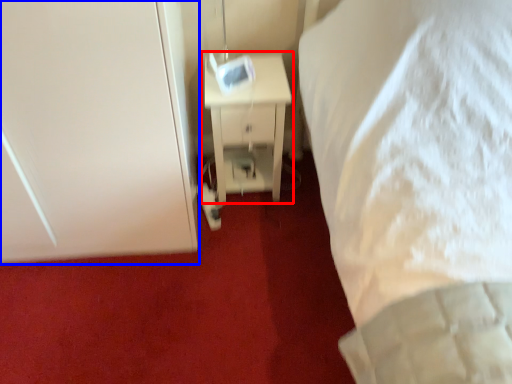
Question: Which object appears farthest to the camera in this image, nightstand (highlighted by a red box) or door (highlighted by a blue box)?

Choices:
 (A) nightstand
 (B) door

Answer: (A)